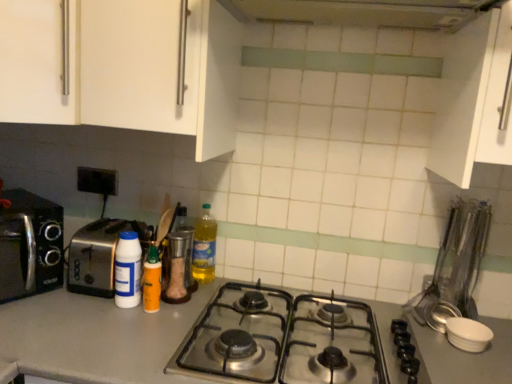
This screenshot has width=512, height=384. In order to click on free space in front of translucent plastic bottle at center, acting as the 4th bottle starting from the left in this screenshot , I will do `click(185, 301)`.